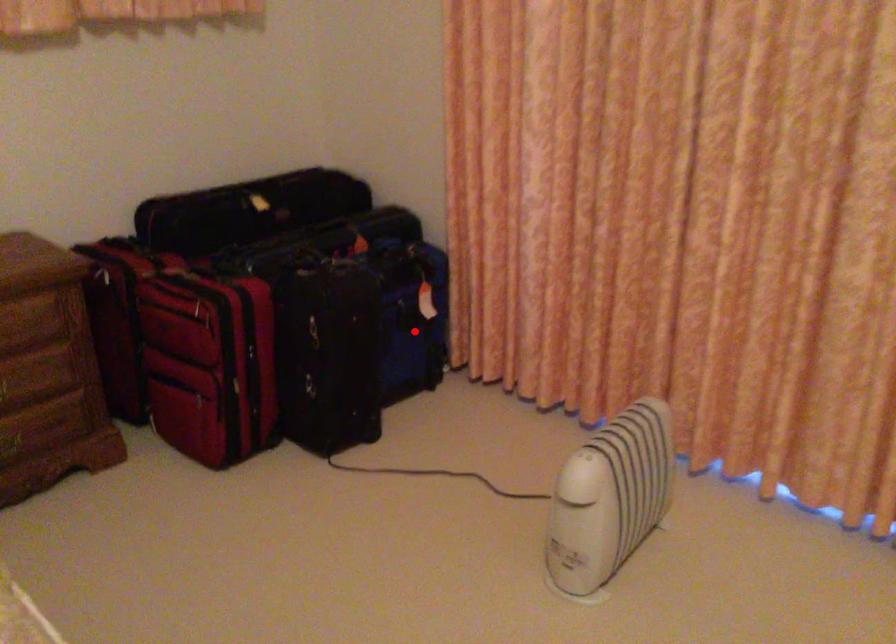
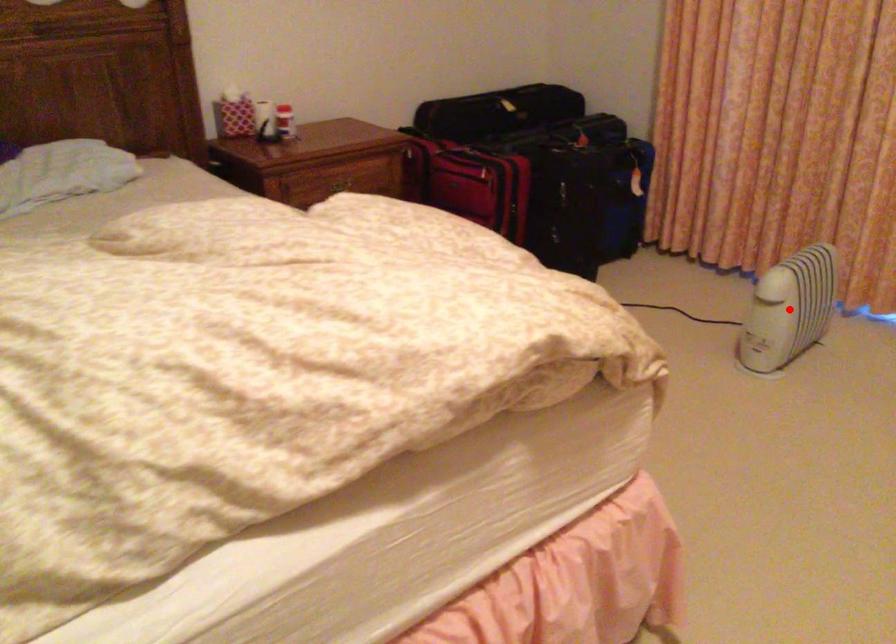
I am providing you with two images of the same scene from different viewpoints. A red point is marked on the first image and another point is marked on the second image. Do the highlighted points in image1 and image2 indicate the same real-world spot?

No